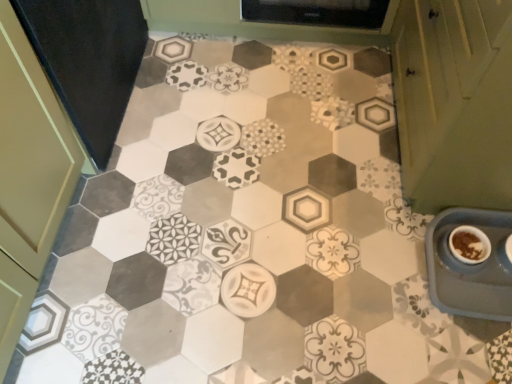
Question: Is green matte cabinet at right to the left or to the right of blue plastic tray at lower right in the image?

Choices:
 (A) right
 (B) left

Answer: (A)

Question: Is green matte cabinet at right in front of or behind blue plastic tray at lower right in the image?

Choices:
 (A) behind
 (B) front

Answer: (B)

Question: Which of these objects is positioned closest to the green matte cabinet at right?

Choices:
 (A) blue plastic tray at lower right
 (B) brown matte bowl at lower right

Answer: (A)

Question: Which is nearer to the green matte cabinet at right?

Choices:
 (A) blue plastic tray at lower right
 (B) brown matte bowl at lower right

Answer: (A)